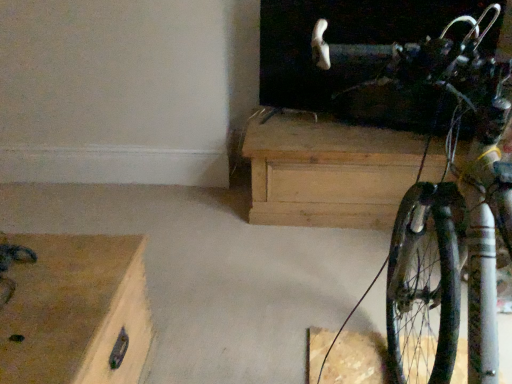
At what (x,y) coordinates should I click in order to perform the action: click on vacant space to the left of natural wood chest at center, which is counted as the 2th chest of drawers, starting from the front. Please return your answer as a coordinate pair (x, y). Looking at the image, I should click on (188, 224).